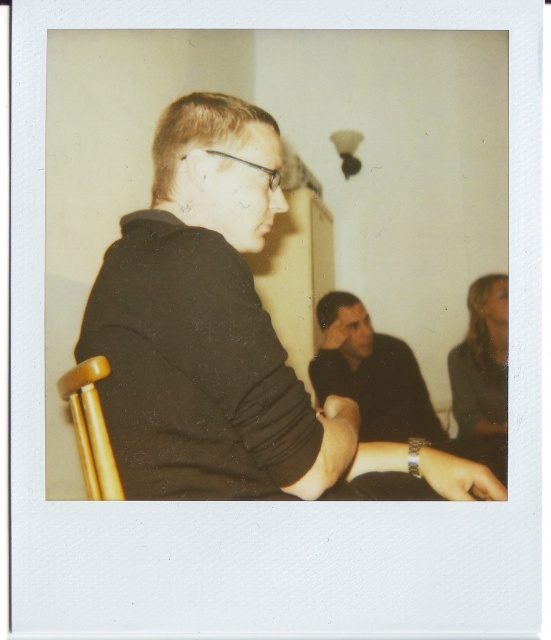
You are organizing a photo shoot and need to ensure that all accessories are visible in the final image. Given the current setup with the black matte shirt at center and the metallic wristwatch at lower center, which object would you adjust to improve visibility of the wristwatch?

Since the black matte shirt at center is larger than the metallic wristwatch at lower center, adjusting the position of the black matte shirt at center to make more space could help improve the visibility of the metallic wristwatch at lower center.

Based on the photo, you are a tailor measuring the distance between the black matte shirt at center and the metallic wristwatch at lower center for a custom fitting. Can you fit a 10 inch long accessory between them?

The distance between the black matte shirt at center and the metallic wristwatch at lower center is 11.37 inches, so yes, a 10 inch long accessory can fit between them since it is shorter than the available space.